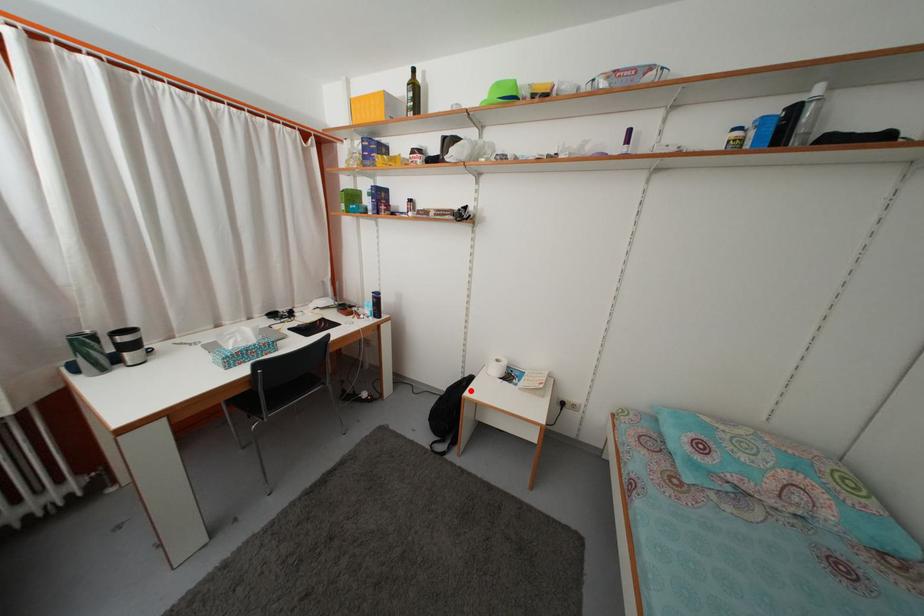
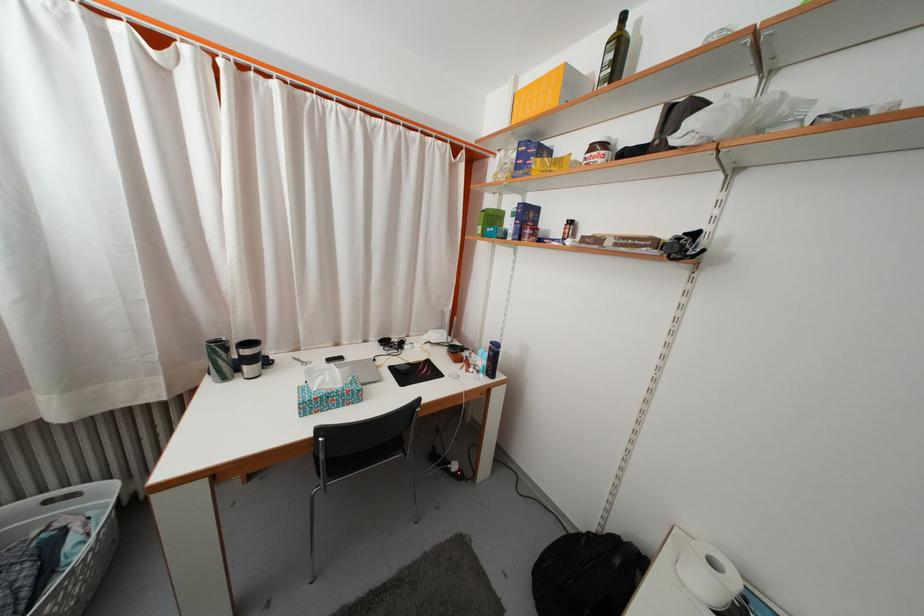
Question: I am providing you with two images of the same scene from different viewpoints. A red point is shown in image1. For the corresponding object point in image2, is it positioned nearer or farther from the camera?

Choices:
 (A) Nearer
 (B) Farther

Answer: (B)